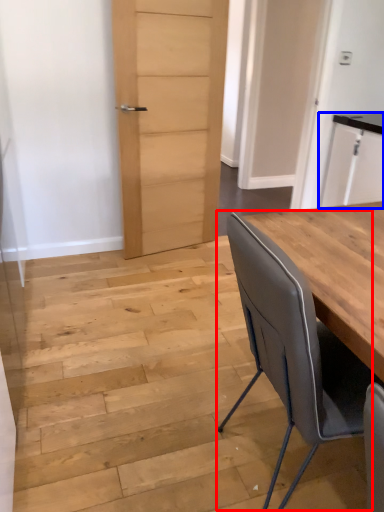
Question: Which object appears farthest to the camera in this image, chair (highlighted by a red box) or cabinetry (highlighted by a blue box)?

Choices:
 (A) chair
 (B) cabinetry

Answer: (B)